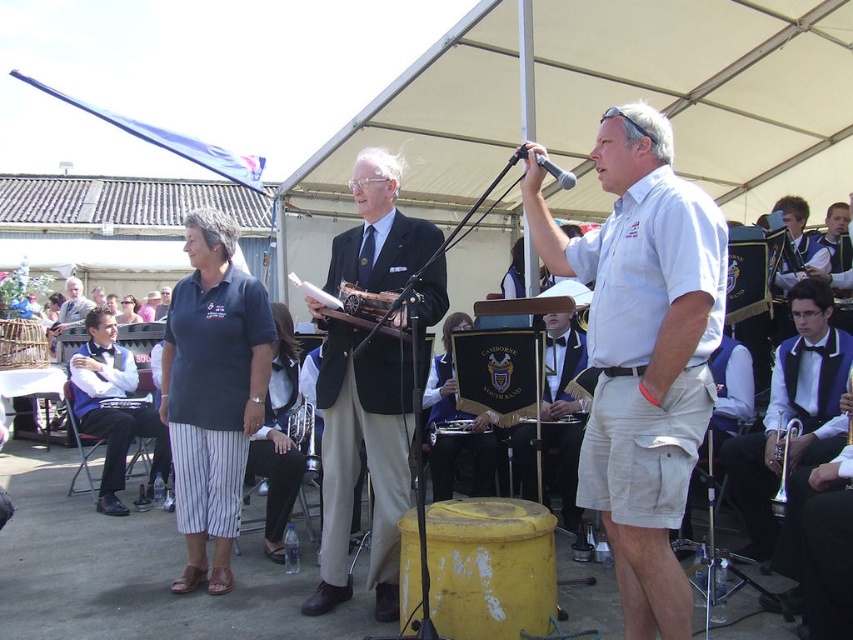
Question: Which point is farther to the camera?

Choices:
 (A) (544, 168)
 (B) (415, 300)
 (C) (125, 515)

Answer: (C)

Question: From the image, what is the correct spatial relationship of wooden microphone at center in relation to metallic silver microphone at upper center?

Choices:
 (A) above
 (B) below

Answer: (B)

Question: Does black satin vest at right appear under brass bell at center?

Choices:
 (A) yes
 (B) no

Answer: (B)

Question: Is black satin vest at right smaller than brass bell at center?

Choices:
 (A) no
 (B) yes

Answer: (A)

Question: Among these points, which one is nearest to the camera?

Choices:
 (A) (785, 492)
 (B) (695, 228)

Answer: (B)

Question: Which object appears closest to the camera in this image?

Choices:
 (A) metallic silver microphone at upper center
 (B) black satin vest at right
 (C) wooden microphone at center
 (D) matte black suit at center

Answer: (A)